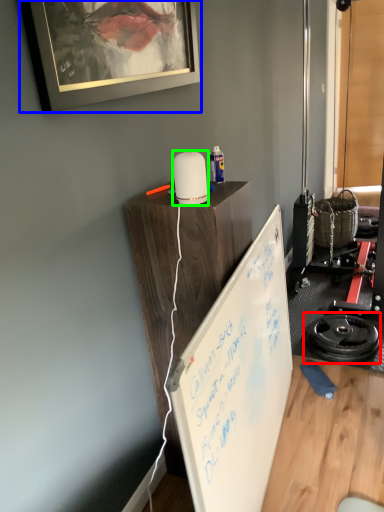
Question: Which object is positioned closest to wheel (highlighted by a red box)? Select from picture frame (highlighted by a blue box) and appliance (highlighted by a green box).

Choices:
 (A) picture frame
 (B) appliance

Answer: (B)